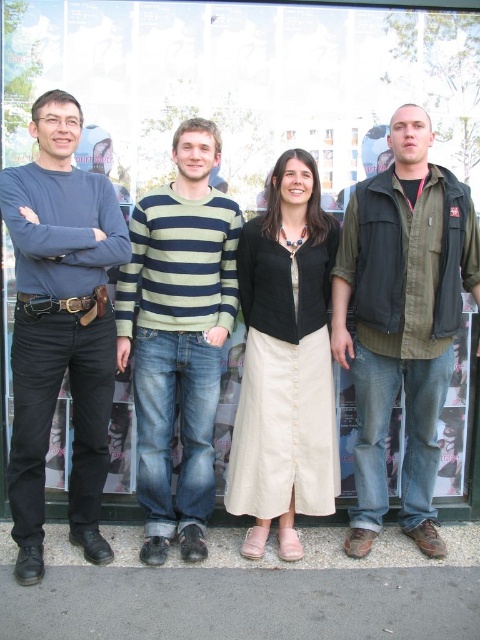
Question: Which of the following is the closest to the observer?

Choices:
 (A) beige cotton skirt at center
 (B) green cotton shirt at center
 (C) matte blue shirt at left

Answer: (C)

Question: Does green cotton shirt at center appear under matte blue shirt at left?

Choices:
 (A) yes
 (B) no

Answer: (B)

Question: Which of the following is the closest to the observer?

Choices:
 (A) striped knit sweater at center
 (B) green cotton shirt at center
 (C) matte blue shirt at left
 (D) beige cotton skirt at center

Answer: (C)

Question: Which point is farther to the camera?

Choices:
 (A) (210, 225)
 (B) (310, 241)

Answer: (A)

Question: Does green cotton shirt at center come in front of striped knit sweater at center?

Choices:
 (A) no
 (B) yes

Answer: (B)

Question: Can you confirm if green cotton shirt at center is positioned above beige cotton skirt at center?

Choices:
 (A) no
 (B) yes

Answer: (B)